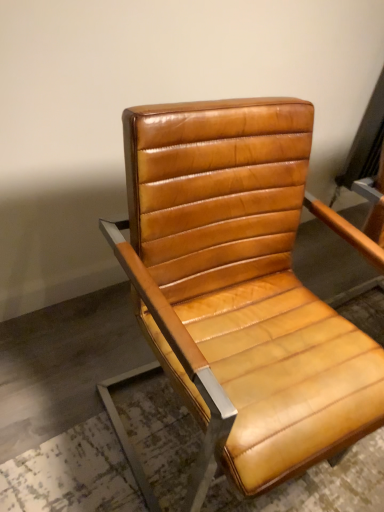
Question: Should I look upward or downward to see matte leather chair at center?

Choices:
 (A) down
 (B) up

Answer: (A)